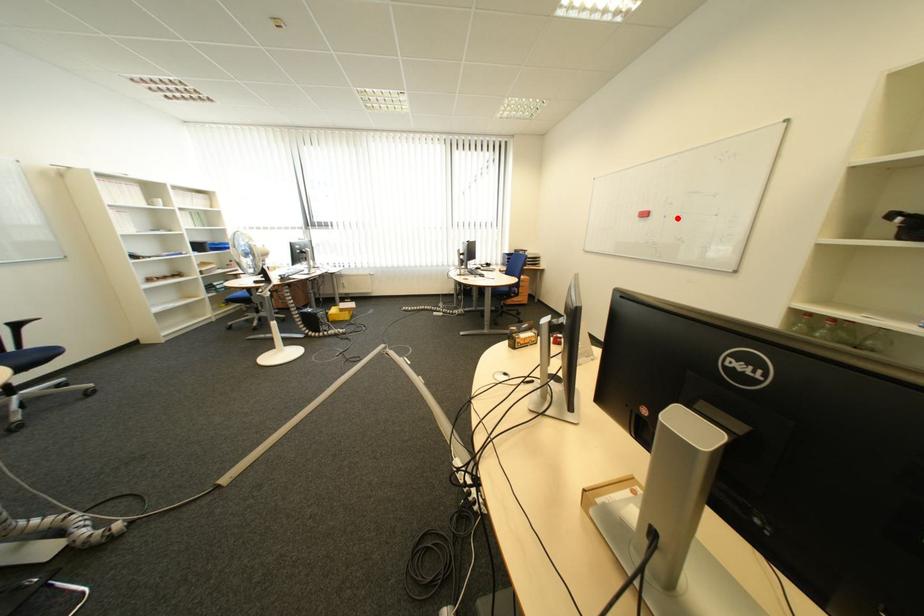
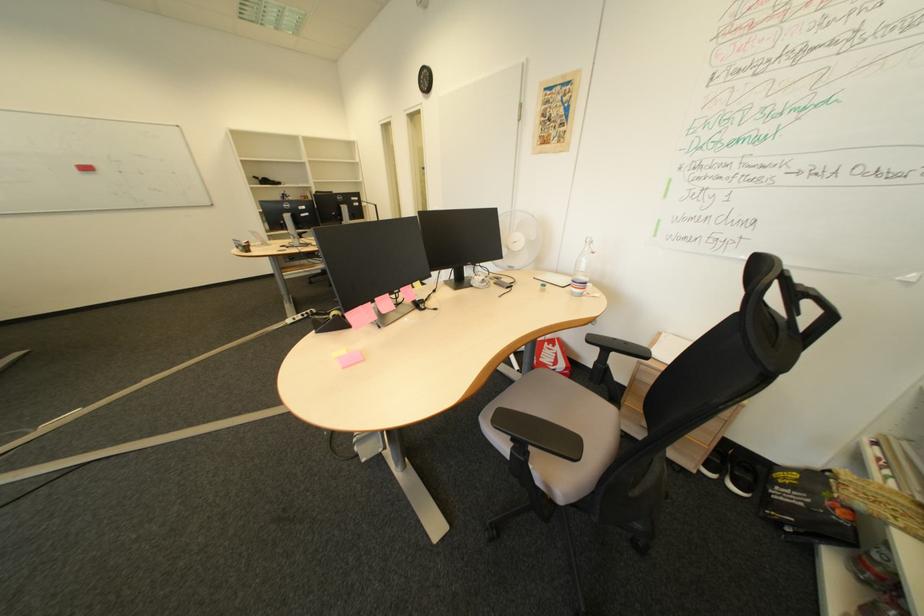
The point at the highlighted location is marked in the first image. Where is the corresponding point in the second image?

(135, 174)